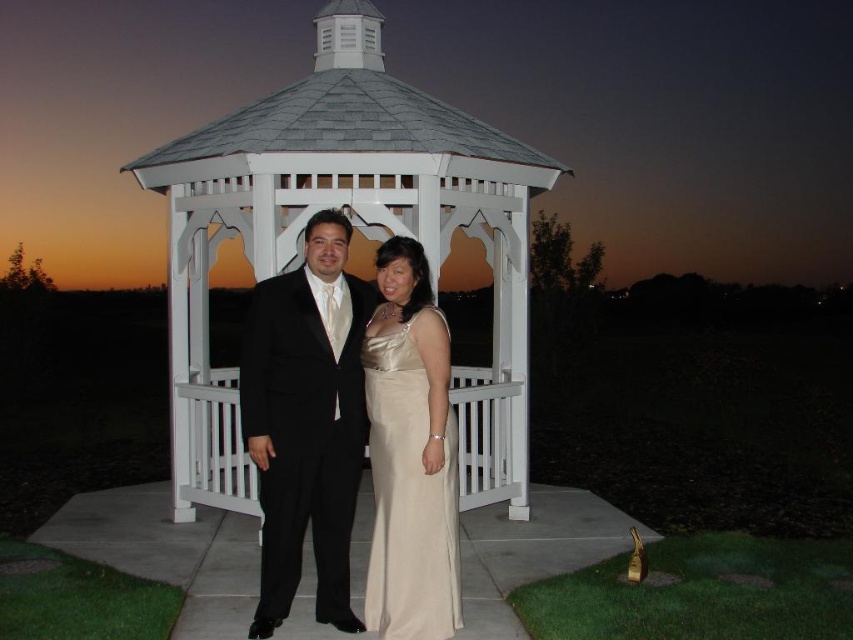
Question: Is black satin suit at center bigger than satin dress at center?

Choices:
 (A) yes
 (B) no

Answer: (A)

Question: Estimate the real-world distances between objects in this image. Which object is closer to the black satin suit at center?

Choices:
 (A) satin dress at center
 (B) white wooden gazebo at center

Answer: (A)

Question: Which point appears closest to the camera in this image?

Choices:
 (A) 341,54
 (B) 373,362
 (C) 338,490

Answer: (B)

Question: Among these objects, which one is farthest from the camera?

Choices:
 (A) black satin suit at center
 (B) white wooden gazebo at center

Answer: (B)

Question: Does white wooden gazebo at center appear on the right side of satin dress at center?

Choices:
 (A) yes
 (B) no

Answer: (B)

Question: Can you confirm if white wooden gazebo at center is smaller than satin dress at center?

Choices:
 (A) yes
 (B) no

Answer: (B)